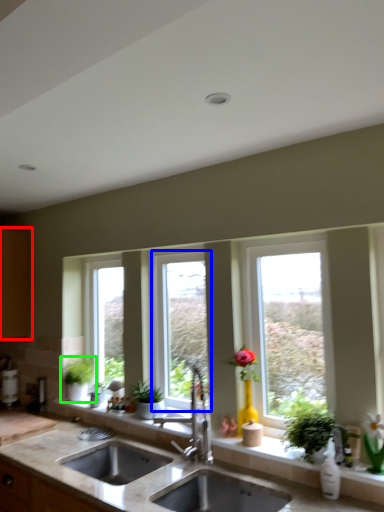
Question: Which object is positioned farthest from cabinetry (highlighted by a red box)? Select from window (highlighted by a blue box) and houseplant (highlighted by a green box).

Choices:
 (A) window
 (B) houseplant

Answer: (A)